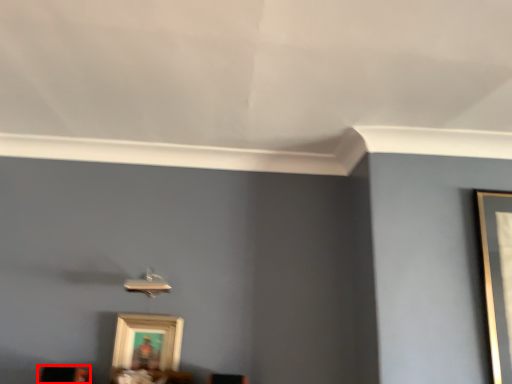
Question: From the image's perspective, what is the correct spatial relationship of furniture (annotated by the red box) in relation to picture frame?

Choices:
 (A) below
 (B) above

Answer: (A)